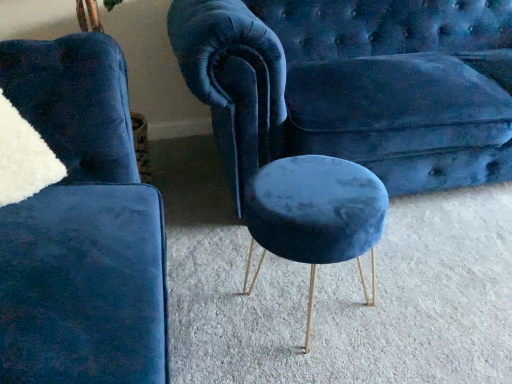
The width and height of the screenshot is (512, 384). Find the location of `free space above velvet blue stool at center (from a real-world perspective)`. free space above velvet blue stool at center (from a real-world perspective) is located at coordinates (312, 184).